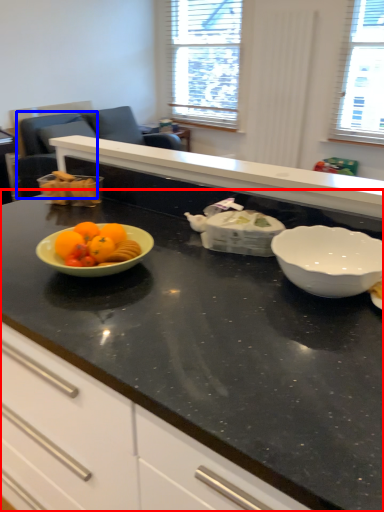
Question: Which object appears farthest to the camera in this image, countertop (highlighted by a red box) or armchair (highlighted by a blue box)?

Choices:
 (A) countertop
 (B) armchair

Answer: (B)